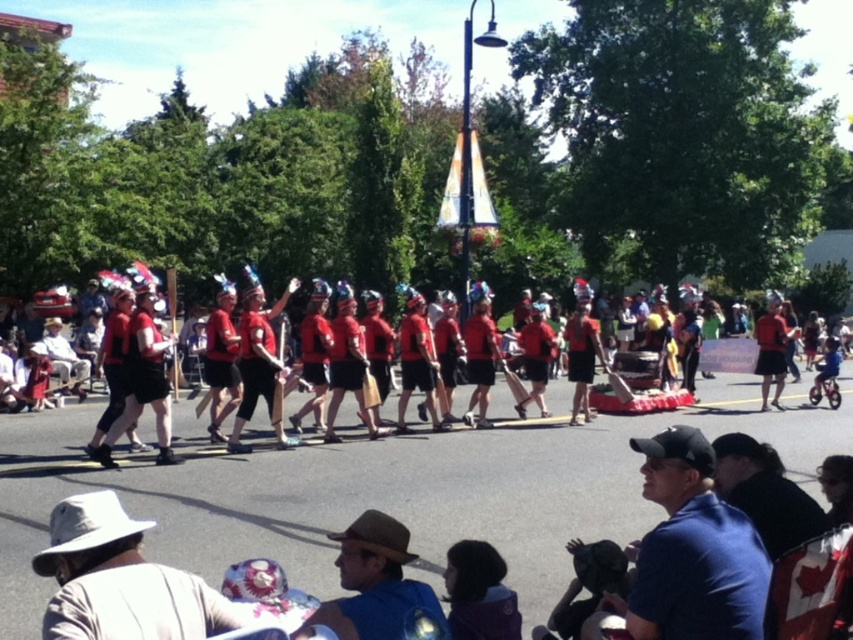
The height and width of the screenshot is (640, 853). Describe the element at coordinates (373, 582) in the screenshot. I see `brown felt hat at lower center` at that location.

Which is behind, point (430, 608) or point (228, 449)?

Point (228, 449)

Describe the element at coordinates (373, 582) in the screenshot. This screenshot has width=853, height=640. I see `brown felt hat at lower center` at that location.

The image size is (853, 640). In order to click on brown felt hat at lower center in this screenshot , I will do `click(373, 582)`.

From the picture: Does red matte uniform at center have a greater height compared to shiny metallic helmet at center?

No.

From the picture: Which of these two, red matte uniform at center or shiny metallic helmet at center, stands taller?

Standing taller between the two is shiny metallic helmet at center.

Is point (480, 445) less distant than point (268, 381)?

No, it is behind (268, 381).

At what (x,y) coordinates should I click in order to perform the action: click on red matte uniform at center. Please return your answer as a coordinate pair (x, y). The height and width of the screenshot is (640, 853). Looking at the image, I should click on (440, 444).

Which is behind, point (375, 547) or point (596, 339)?

The point (596, 339) is behind.

The width and height of the screenshot is (853, 640). What do you see at coordinates (373, 582) in the screenshot? I see `brown felt hat at lower center` at bounding box center [373, 582].

This screenshot has height=640, width=853. Identify the location of brown felt hat at lower center. (373, 582).